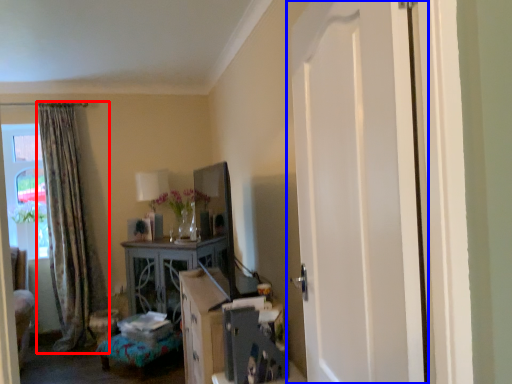
Question: Which point is further to the camera, curtain (highlighted by a red box) or door (highlighted by a blue box)?

Choices:
 (A) curtain
 (B) door

Answer: (A)